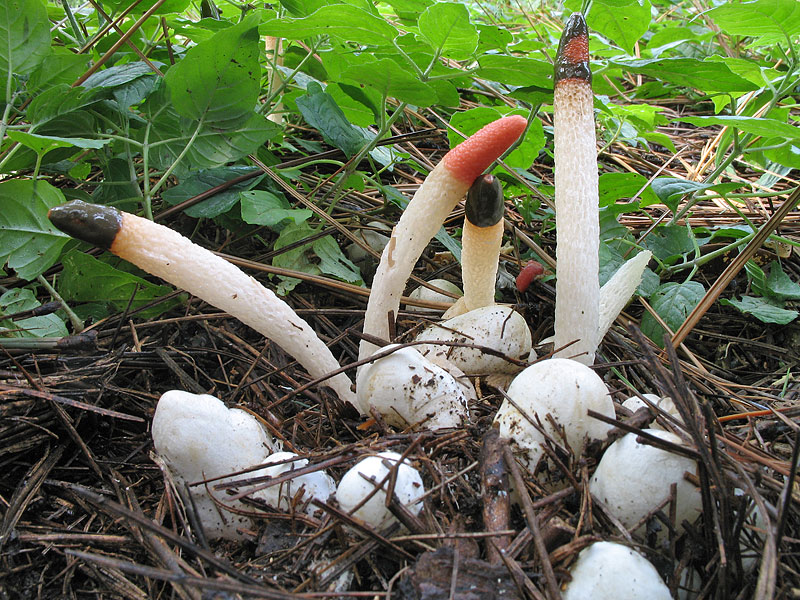
Identify the location of corner. The height and width of the screenshot is (600, 800). (764, 577), (14, 586), (16, 19), (784, 16).